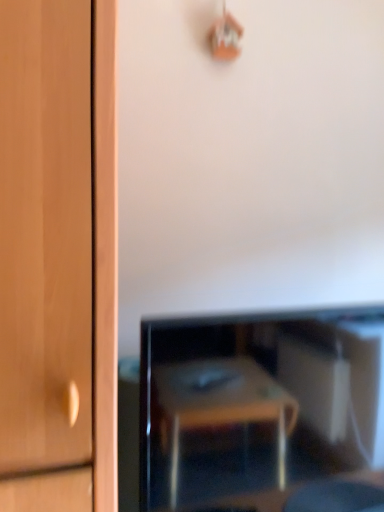
Locate an element on the screen. transparent glass computer desk at lower center is located at coordinates (258, 404).

What do you see at coordinates (258, 404) in the screenshot? The height and width of the screenshot is (512, 384). I see `transparent glass computer desk at lower center` at bounding box center [258, 404].

You are a GUI agent. You are given a task and a screenshot of the screen. Output one action in this format:
    pyautogui.click(x=<x>, y=<y>)
    Task: Click on the transparent glass computer desk at lower center
    
    Given the screenshot: What is the action you would take?
    pyautogui.click(x=258, y=404)